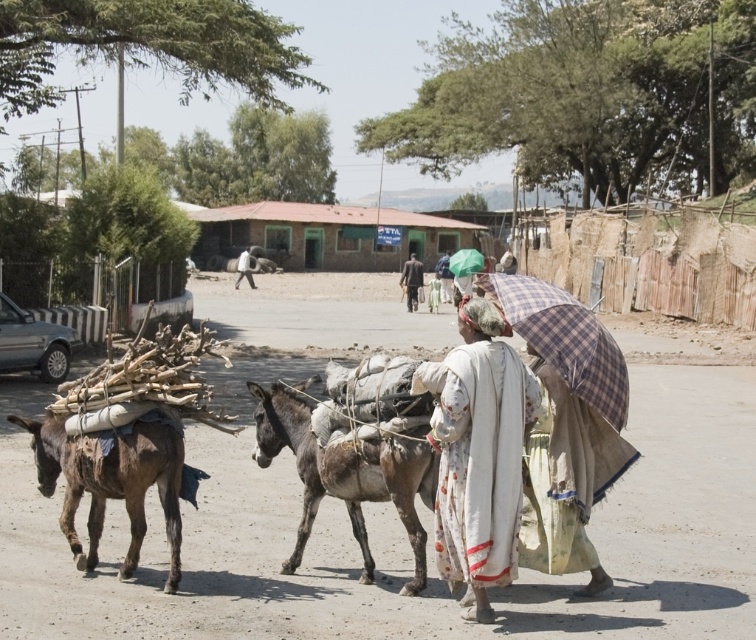
Question: Can you confirm if plaid fabric umbrella at lower right is bigger than brown rough mule at left?

Choices:
 (A) yes
 (B) no

Answer: (B)

Question: Considering the real-world distances, which object is closest to the light brown fabric at center?

Choices:
 (A) dark brown fabric at center
 (B) plaid fabric umbrella at lower right

Answer: (A)

Question: In this image, where is white cloth at center located relative to white clothed man at center?

Choices:
 (A) above
 (B) below

Answer: (B)

Question: Among these objects, which one is nearest to the camera?

Choices:
 (A) light brown fabric at center
 (B) white cloth at center
 (C) plaid fabric umbrella at lower right

Answer: (B)

Question: Which point is farther to the camera?

Choices:
 (A) (435, 272)
 (B) (56, 448)
 (C) (420, 284)
 (D) (249, 257)

Answer: (D)

Question: Does white cloth at center come behind gray rough mule at center?

Choices:
 (A) yes
 (B) no

Answer: (B)